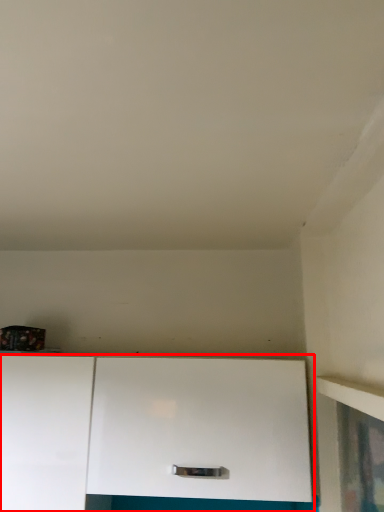
Question: From the image, what is the correct spatial relationship of cabinetry (annotated by the red box) in relation to cabinetry?

Choices:
 (A) left
 (B) right

Answer: (B)